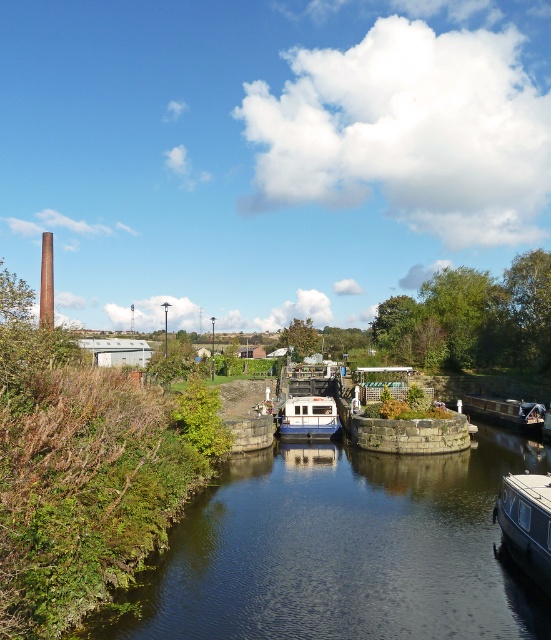
Who is taller, dark green water at center or white glossy boat at center?

dark green water at center is taller.

Which of these two, dark green water at center or white glossy boat at center, stands shorter?

white glossy boat at center

This screenshot has height=640, width=551. Describe the element at coordinates (341, 548) in the screenshot. I see `dark green water at center` at that location.

Find the location of a particular element. This screenshot has width=551, height=640. dark green water at center is located at coordinates (341, 548).

Does dark green water at center lie behind white glossy boat at lower right?

No, dark green water at center is closer to the viewer.

Image resolution: width=551 pixels, height=640 pixels. I want to click on dark green water at center, so click(x=341, y=548).

Locate an element on the screen. Image resolution: width=551 pixels, height=640 pixels. dark green water at center is located at coordinates (341, 548).

Is white glossy boat at lower right smaller than white glossy boat at center?

Incorrect, white glossy boat at lower right is not smaller in size than white glossy boat at center.

You are a GUI agent. You are given a task and a screenshot of the screen. Output one action in this format:
    pyautogui.click(x=<x>, y=<y>)
    Task: Click on the white glossy boat at lower right
    The image size is (551, 640).
    Given the screenshot: What is the action you would take?
    pyautogui.click(x=526, y=524)